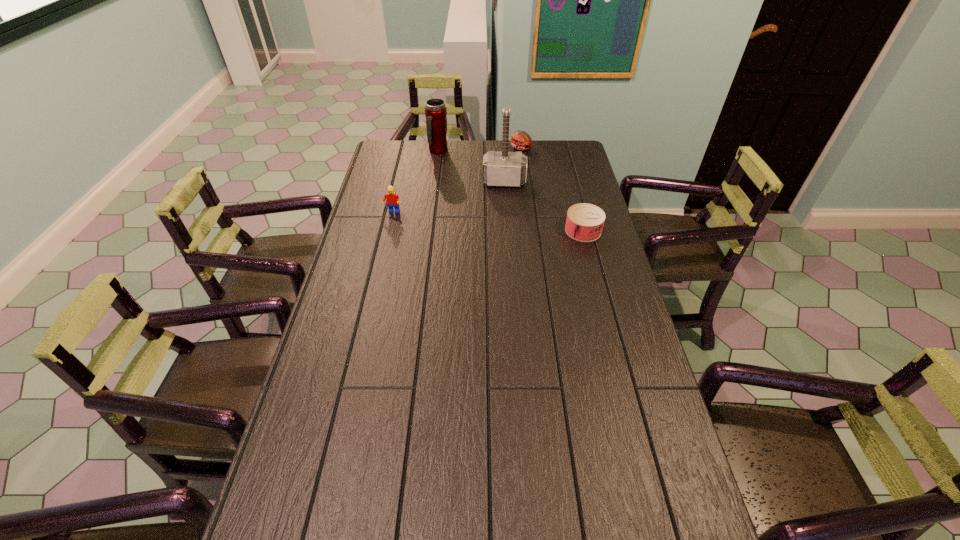
In order to click on free space between the leftmost object and the thermos bottle in this screenshot , I will do `click(416, 181)`.

Where is `vacant area that lies between the tallest object and the Lego`? This screenshot has width=960, height=540. vacant area that lies between the tallest object and the Lego is located at coordinates (448, 197).

Locate an element on the screen. free space that is in between the hammer and the thermos bottle is located at coordinates (471, 166).

You are a GUI agent. You are given a task and a screenshot of the screen. Output one action in this format:
    pyautogui.click(x=<x>, y=<y>)
    Task: Click on the free spot between the tomato and the thermos bottle
    
    Given the screenshot: What is the action you would take?
    pyautogui.click(x=480, y=150)

Find the location of a particular element. The height and width of the screenshot is (540, 960). free point between the fourth object from right to left and the nearest object is located at coordinates (511, 191).

You are a GUI agent. You are given a task and a screenshot of the screen. Output one action in this format:
    pyautogui.click(x=<x>, y=<y>)
    Task: Click on the vacant region between the leftmost object and the nearest object
    
    Given the screenshot: What is the action you would take?
    pyautogui.click(x=488, y=221)

The width and height of the screenshot is (960, 540). Find the location of `vacant space in between the thermos bottle and the tomato`. vacant space in between the thermos bottle and the tomato is located at coordinates (480, 150).

Where is `unoccupied area between the leftmost object and the fourth shortest object`? Image resolution: width=960 pixels, height=540 pixels. unoccupied area between the leftmost object and the fourth shortest object is located at coordinates (416, 181).

Identify which object is the closest to the tomato. Please provide its 2D coordinates. Your answer should be formatted as a tuple, i.e. [(x, y)], where the tuple contains the x and y coordinates of a point satisfying the conditions above.

[(502, 169)]

Image resolution: width=960 pixels, height=540 pixels. I want to click on object that is the closest to the second nearest object, so click(502, 169).